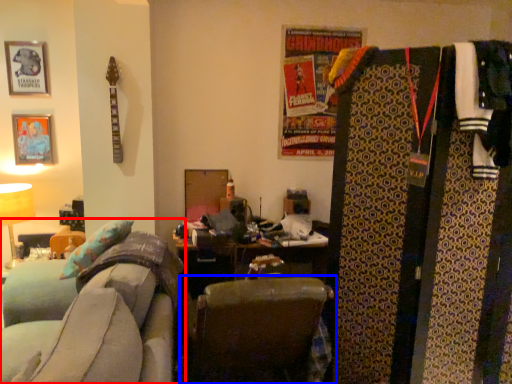
Question: Which of the following is the farthest to the observer, furniture (highlighted by a red box) or chair (highlighted by a blue box)?

Choices:
 (A) furniture
 (B) chair

Answer: (B)